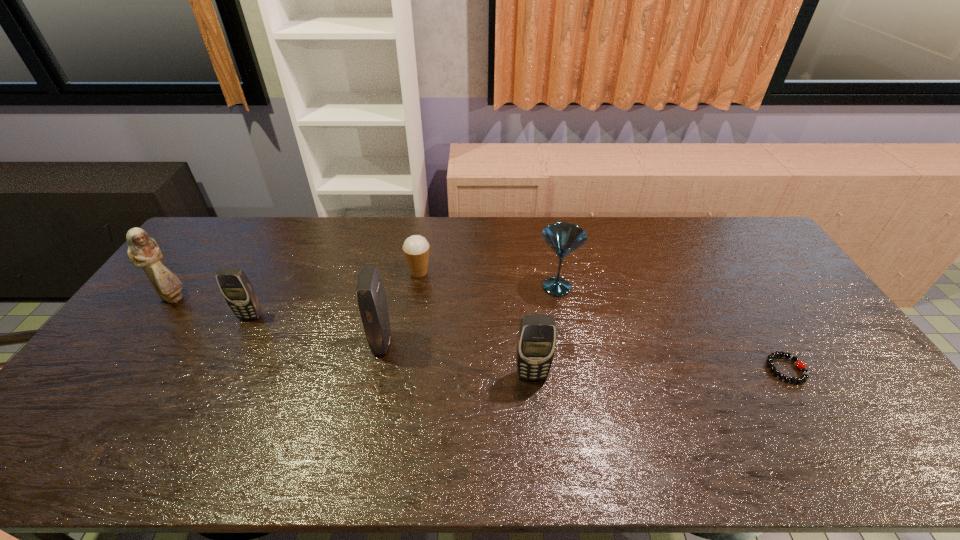
Where is `empty space that is in between the leftmost object and the sixth tallest object`? This screenshot has height=540, width=960. empty space that is in between the leftmost object and the sixth tallest object is located at coordinates (297, 285).

Identify the location of empty space between the martini and the third object from left to right. (469, 315).

You are a GUI agent. You are given a task and a screenshot of the screen. Output one action in this format:
    pyautogui.click(x=<x>, y=<y>)
    Task: Click on the free space between the leftmost object and the rightmost cellular telephone
    The width and height of the screenshot is (960, 540).
    Given the screenshot: What is the action you would take?
    click(x=353, y=336)

Where is `free space between the rightmost object and the second nearest cellular telephone`? The height and width of the screenshot is (540, 960). free space between the rightmost object and the second nearest cellular telephone is located at coordinates (584, 356).

Where is `free area in between the rightmost cellular telephone and the figurine`? free area in between the rightmost cellular telephone and the figurine is located at coordinates (353, 336).

Locate an element on the screen. This screenshot has width=960, height=540. object that stands as the fourth closest to the shortest object is located at coordinates (370, 291).

At what (x,y) coordinates should I click in order to perform the action: click on the second closest object to the shortest object. Please return your answer as a coordinate pair (x, y). Looking at the image, I should click on (536, 340).

Identify which cellular telephone is the second nearest to the second cellular telephone from right to left. Please provide its 2D coordinates. Your answer should be formatted as a tuple, i.e. [(x, y)], where the tuple contains the x and y coordinates of a point satisfying the conditions above.

[(235, 286)]

Choose which cellular telephone is the nearest neighbor to the second cellular telephone from left to right. Please provide its 2D coordinates. Your answer should be formatted as a tuple, i.e. [(x, y)], where the tuple contains the x and y coordinates of a point satisfying the conditions above.

[(536, 340)]

Identify the location of vacant space that satisfies the following two spatial constraints: 1. on the front face of the shortest object; 2. on the left side of the sixth object from right to left. This screenshot has height=540, width=960. (223, 369).